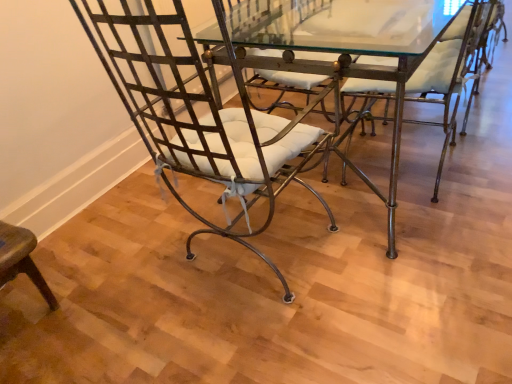
Question: Does metallic wrought iron chair at center, the 1th chair when ordered from right to left, turn towards metallic wire chair at left, which appears as the second chair when viewed from the right?

Choices:
 (A) no
 (B) yes

Answer: (A)

Question: Considering the relative sizes of metallic wrought iron chair at center, which is the 2th chair from left to right, and metallic wire chair at left, the 1th chair viewed from the left, in the image provided, is metallic wrought iron chair at center, which is the 2th chair from left to right, shorter than metallic wire chair at left, the 1th chair viewed from the left,?

Choices:
 (A) no
 (B) yes

Answer: (B)

Question: Is metallic wrought iron chair at center, the 1th chair when ordered from right to left, further to camera compared to metallic wire chair at left, the 1th chair viewed from the left?

Choices:
 (A) yes
 (B) no

Answer: (A)

Question: Considering the relative sizes of metallic wrought iron chair at center, which is the 2th chair from left to right, and metallic wire chair at left, the 1th chair viewed from the left, in the image provided, is metallic wrought iron chair at center, which is the 2th chair from left to right, bigger than metallic wire chair at left, the 1th chair viewed from the left,?

Choices:
 (A) no
 (B) yes

Answer: (A)

Question: Is metallic wrought iron chair at center, the 1th chair when ordered from right to left, at the left side of metallic wire chair at left, the 1th chair viewed from the left?

Choices:
 (A) yes
 (B) no

Answer: (B)

Question: Is metallic wire chair at left, which appears as the second chair when viewed from the right, taller or shorter than metallic wrought iron chair at center, the 1th chair when ordered from right to left?

Choices:
 (A) tall
 (B) short

Answer: (A)

Question: Does point (128, 16) appear closer or farther from the camera than point (458, 82)?

Choices:
 (A) closer
 (B) farther

Answer: (A)

Question: From a real-world perspective, is metallic wire chair at left, which appears as the second chair when viewed from the right, above or below metallic wrought iron chair at center, the 1th chair when ordered from right to left?

Choices:
 (A) below
 (B) above

Answer: (B)

Question: Choose the correct answer: Is metallic wire chair at left, the 1th chair viewed from the left, inside metallic wrought iron chair at center, the 1th chair when ordered from right to left, or outside it?

Choices:
 (A) inside
 (B) outside

Answer: (B)

Question: Is point (335, 29) positioned closer to the camera than point (459, 82)?

Choices:
 (A) farther
 (B) closer

Answer: (A)

Question: Looking at their shapes, would you say metallic/glass table at center is wider or thinner than metallic wrought iron chair at center, which is the 2th chair from left to right?

Choices:
 (A) thin
 (B) wide

Answer: (B)

Question: Considering the positions of metallic/glass table at center and metallic wrought iron chair at center, which is the 2th chair from left to right, in the image, is metallic/glass table at center bigger or smaller than metallic wrought iron chair at center, which is the 2th chair from left to right,?

Choices:
 (A) big
 (B) small

Answer: (A)

Question: From the image's perspective, is metallic/glass table at center above or below metallic wrought iron chair at center, which is the 2th chair from left to right?

Choices:
 (A) above
 (B) below

Answer: (A)

Question: Based on their sizes in the image, would you say metallic wrought iron chair at center, which is the 2th chair from left to right, is bigger or smaller than metallic/glass table at center?

Choices:
 (A) small
 (B) big

Answer: (A)

Question: From a real-world perspective, is metallic wrought iron chair at center, which is the 2th chair from left to right, physically located above or below metallic/glass table at center?

Choices:
 (A) below
 (B) above

Answer: (B)